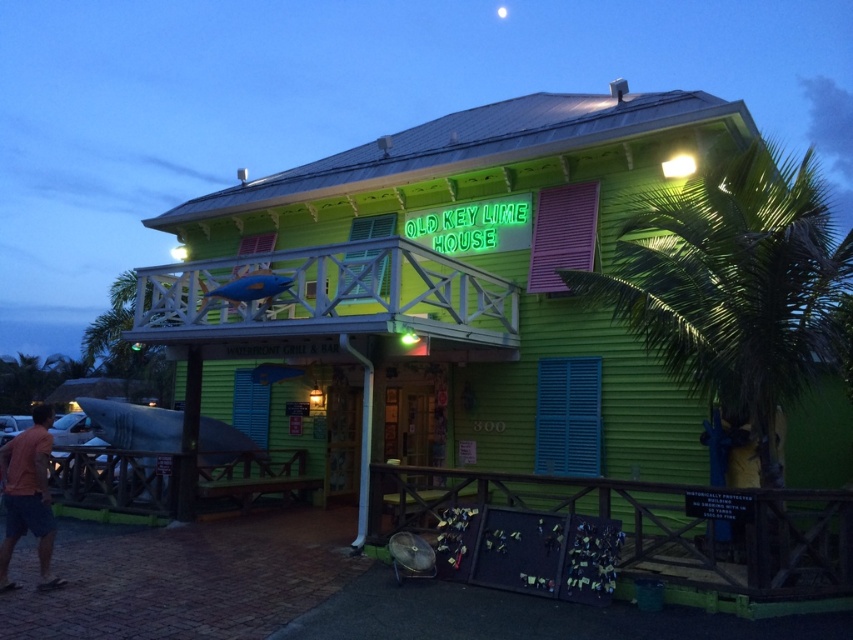
Question: Does orange cotton t-shirt at lower left come behind neon green sign at upper center?

Choices:
 (A) no
 (B) yes

Answer: (A)

Question: Among these points, which one is farthest from the camera?

Choices:
 (A) (492, 204)
 (B) (3, 577)

Answer: (A)

Question: Does orange cotton t-shirt at lower left have a greater width compared to neon green sign at upper center?

Choices:
 (A) yes
 (B) no

Answer: (A)

Question: Which point appears closest to the camera in this image?

Choices:
 (A) (53, 528)
 (B) (451, 218)

Answer: (A)

Question: Is orange cotton t-shirt at lower left wider than neon green sign at upper center?

Choices:
 (A) no
 (B) yes

Answer: (B)